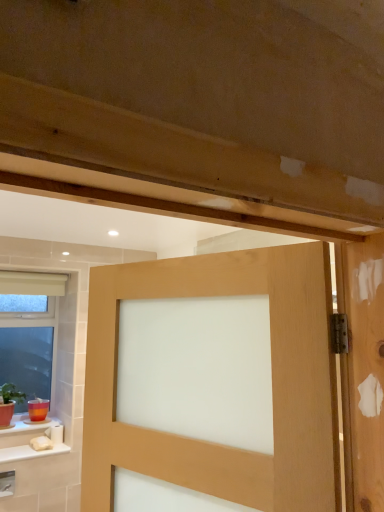
Question: Does transparent glass window at lower left have a greater width compared to satin wood door at center?

Choices:
 (A) no
 (B) yes

Answer: (A)

Question: Is transparent glass window at lower left smaller than satin wood door at center?

Choices:
 (A) yes
 (B) no

Answer: (A)

Question: Can you confirm if transparent glass window at lower left is taller than satin wood door at center?

Choices:
 (A) yes
 (B) no

Answer: (A)

Question: Does transparent glass window at lower left appear on the right side of satin wood door at center?

Choices:
 (A) yes
 (B) no

Answer: (B)

Question: Does transparent glass window at lower left come behind satin wood door at center?

Choices:
 (A) yes
 (B) no

Answer: (A)

Question: Are transparent glass window at lower left and satin wood door at center beside each other?

Choices:
 (A) yes
 (B) no

Answer: (B)

Question: From the image's perspective, is satin wood door at center below transparent glass window at lower left?

Choices:
 (A) no
 (B) yes

Answer: (A)

Question: Is satin wood door at center far from transparent glass window at lower left?

Choices:
 (A) yes
 (B) no

Answer: (A)

Question: From a real-world perspective, is satin wood door at center on top of transparent glass window at lower left?

Choices:
 (A) yes
 (B) no

Answer: (A)

Question: Considering the relative sizes of satin wood door at center and transparent glass window at lower left in the image provided, is satin wood door at center smaller than transparent glass window at lower left?

Choices:
 (A) yes
 (B) no

Answer: (B)

Question: Considering the relative positions of satin wood door at center and transparent glass window at lower left in the image provided, is satin wood door at center to the left of transparent glass window at lower left from the viewer's perspective?

Choices:
 (A) no
 (B) yes

Answer: (A)

Question: Considering the relative positions of satin wood door at center and transparent glass window at lower left in the image provided, is satin wood door at center in front of transparent glass window at lower left?

Choices:
 (A) no
 (B) yes

Answer: (B)

Question: From the image's perspective, is satin wood door at center located above or below transparent glass window at lower left?

Choices:
 (A) above
 (B) below

Answer: (A)